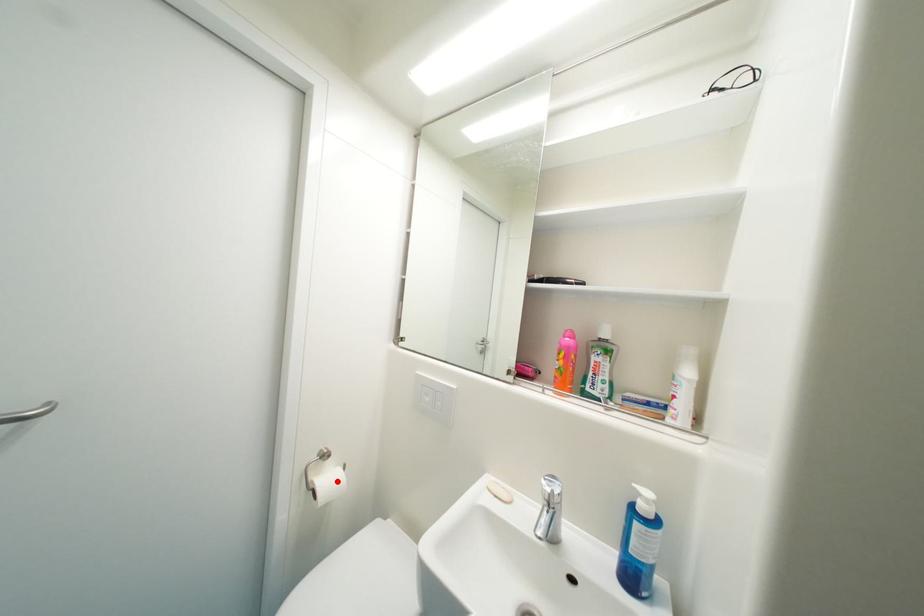
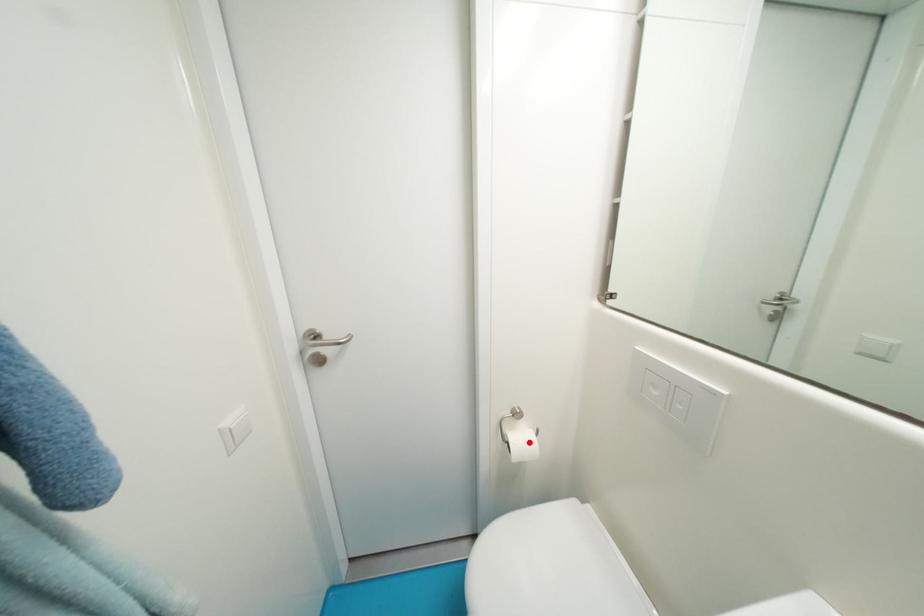
I am providing you with two images of the same scene from different viewpoints. A red point is marked on the first image and another point is marked on the second image. Does the point marked in image1 correspond to the same location as the one in image2?

Yes